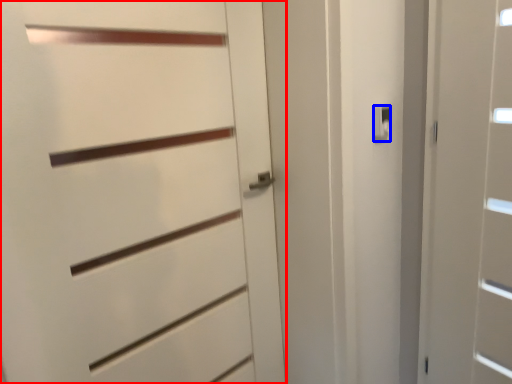
Question: Among these objects, which one is farthest to the camera, door (highlighted by a red box) or latch (highlighted by a blue box)?

Choices:
 (A) door
 (B) latch

Answer: (B)